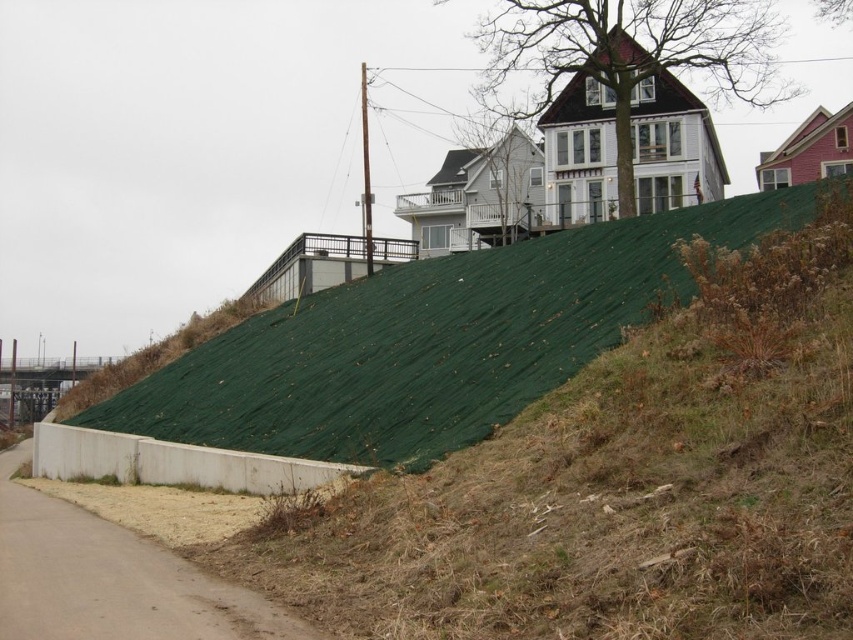
Looking at this image, is green fabric at upper center smaller than brown shingles at upper center?

Yes.

Does green fabric at upper center appear on the left side of brown shingles at upper center?

Correct, you'll find green fabric at upper center to the left of brown shingles at upper center.

Measure the distance between green fabric at upper center and camera.

green fabric at upper center and camera are 8.44 meters apart.

Find the location of a particular element. This screenshot has width=853, height=640. green fabric at upper center is located at coordinates (619, 483).